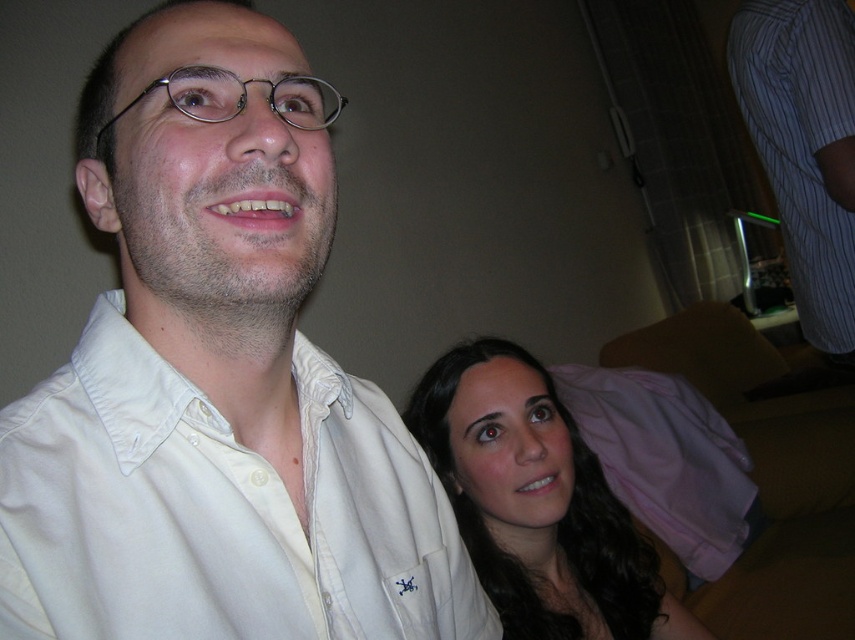
Who is positioned more to the right, white cotton shirt at center or striped cotton dress shirt at upper right?

Positioned to the right is striped cotton dress shirt at upper right.

Is white cotton shirt at center to the right of striped cotton dress shirt at upper right from the viewer's perspective?

Incorrect, white cotton shirt at center is not on the right side of striped cotton dress shirt at upper right.

Who is more forward, (121, 84) or (835, 282)?

Point (121, 84) is in front.

Identify the location of white cotton shirt at center. The height and width of the screenshot is (640, 855). (217, 381).

How far apart are white cotton shirt at center and dark brown hair at lower right?

They are 50.30 centimeters apart.

In the scene shown: Is the position of white cotton shirt at center less distant than that of dark brown hair at lower right?

Yes, white cotton shirt at center is closer to the viewer.

At what (x,y) coordinates should I click in order to perform the action: click on white cotton shirt at center. Please return your answer as a coordinate pair (x, y). Looking at the image, I should click on (217, 381).

Where is `white cotton shirt at center`? This screenshot has height=640, width=855. white cotton shirt at center is located at coordinates (217, 381).

Can you confirm if dark brown hair at lower right is positioned to the right of striped cotton dress shirt at upper right?

In fact, dark brown hair at lower right is to the left of striped cotton dress shirt at upper right.

Measure the distance from dark brown hair at lower right to striped cotton dress shirt at upper right.

dark brown hair at lower right is 25.46 inches from striped cotton dress shirt at upper right.

Where is `dark brown hair at lower right`? dark brown hair at lower right is located at coordinates (537, 502).

Locate an element on the screen. This screenshot has width=855, height=640. dark brown hair at lower right is located at coordinates (537, 502).